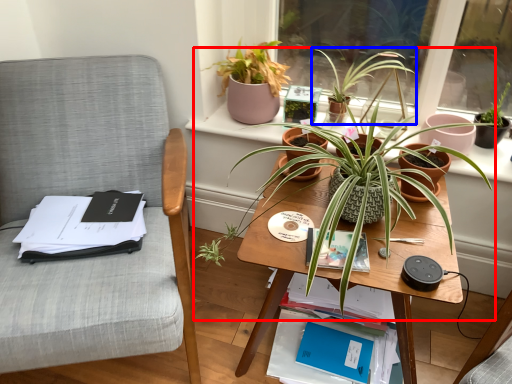
Question: Which object is closer to the camera taking this photo, houseplant (highlighted by a red box) or houseplant (highlighted by a blue box)?

Choices:
 (A) houseplant
 (B) houseplant

Answer: (A)